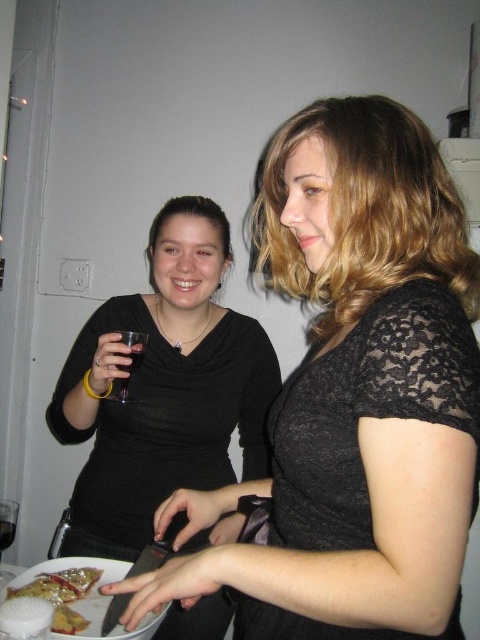
Question: Can you confirm if black lace shirt at center is positioned above matte black shirt at center?

Choices:
 (A) no
 (B) yes

Answer: (B)

Question: Which object is the closest to the matte black shirt at center?

Choices:
 (A) clear glass wine at lower left
 (B) clear plastic cup at upper left
 (C) white matte plate at lower center

Answer: (B)

Question: Is clear plastic cup at upper left behind clear glass wine glass at lower left?

Choices:
 (A) no
 (B) yes

Answer: (B)

Question: Among these objects, which one is farthest from the camera?

Choices:
 (A) black lace shirt at center
 (B) matte black shirt at center
 (C) transparent glass at upper left

Answer: (C)

Question: Is transparent glass at upper left behind clear glass wine at lower left?

Choices:
 (A) no
 (B) yes

Answer: (A)

Question: Which point appears farthest from the camera in this image?

Choices:
 (A) (0, 525)
 (B) (1, 550)
 (C) (452, 326)
 (D) (105, 396)

Answer: (B)